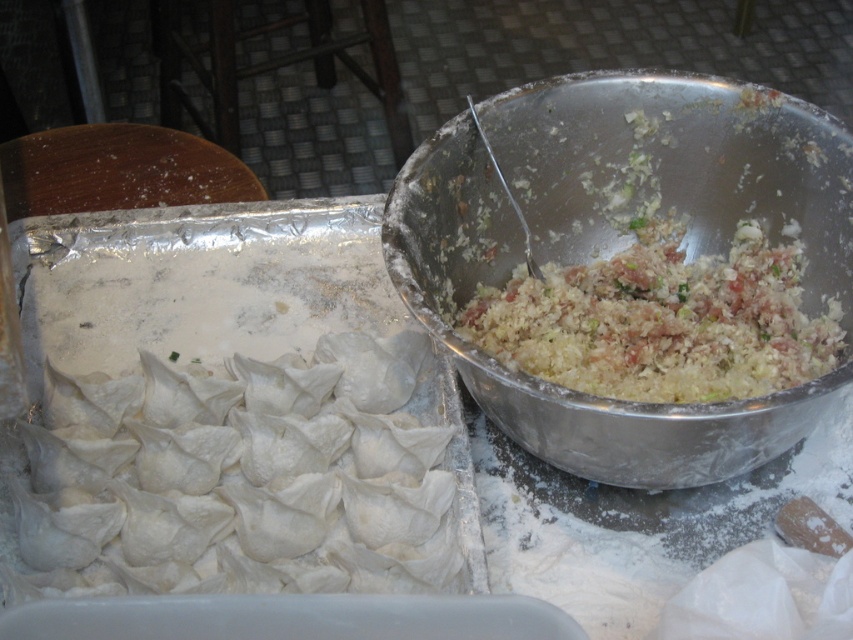
Question: Which object appears closest to the camera in this image?

Choices:
 (A) white doughy dumplings at left
 (B) white crumbly mixture at center
 (C) metallic silver bowl at center

Answer: (C)

Question: Is white doughy dumplings at left below white crumbly mixture at center?

Choices:
 (A) yes
 (B) no

Answer: (A)

Question: Is metallic silver bowl at center bigger than white crumbly mixture at center?

Choices:
 (A) yes
 (B) no

Answer: (A)

Question: Observing the image, what is the correct spatial positioning of metallic silver bowl at center in reference to white doughy dumplings at left?

Choices:
 (A) right
 (B) left

Answer: (A)

Question: Considering the real-world distances, which object is closest to the white doughy dumplings at left?

Choices:
 (A) metallic silver bowl at center
 (B) white crumbly mixture at center

Answer: (A)

Question: Which object is the closest to the white doughy dumplings at left?

Choices:
 (A) white crumbly mixture at center
 (B) metallic silver bowl at center

Answer: (B)